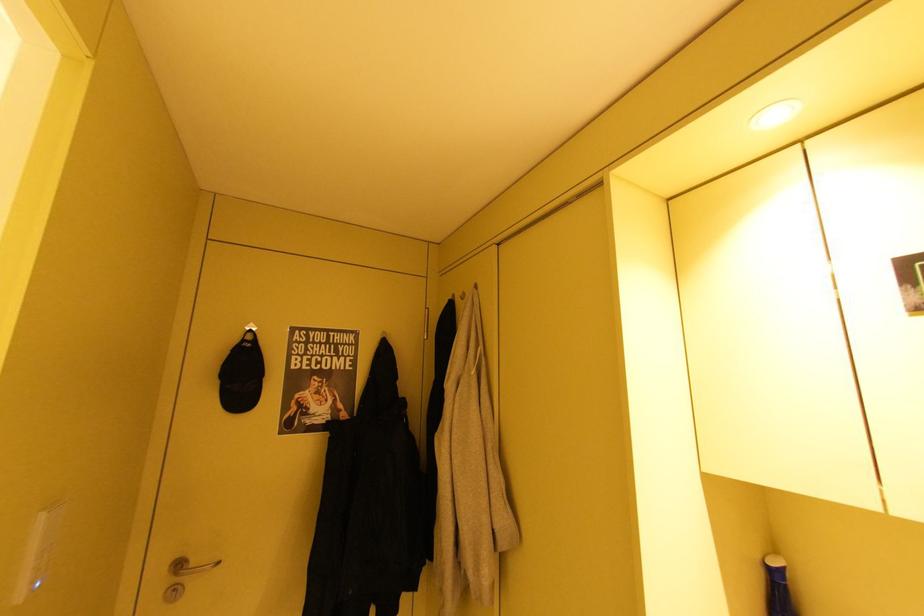
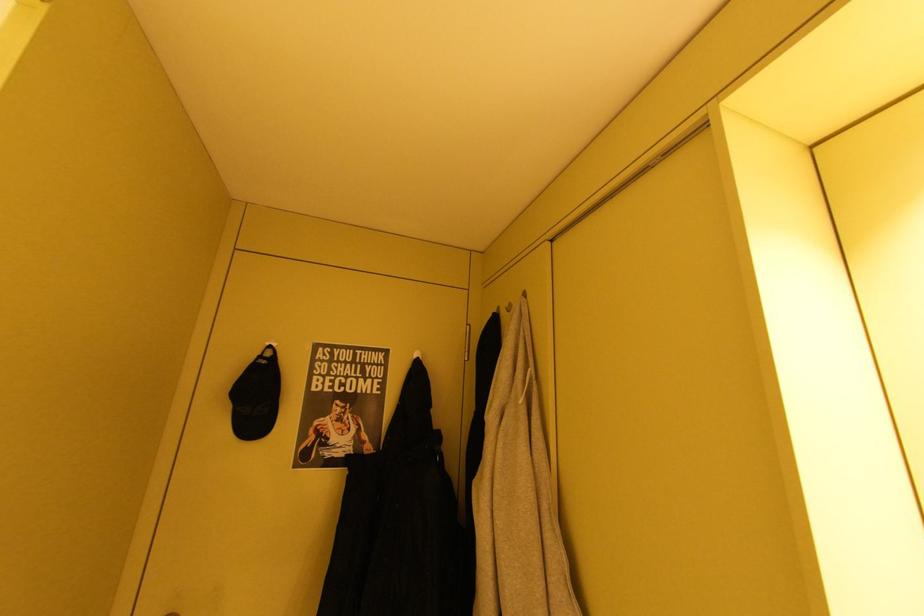
Question: The first image is from the beginning of the video and the second image is from the end. How did the camera likely rotate when shooting the video?

Choices:
 (A) Left
 (B) Right
 (C) Up
 (D) Down

Answer: (A)